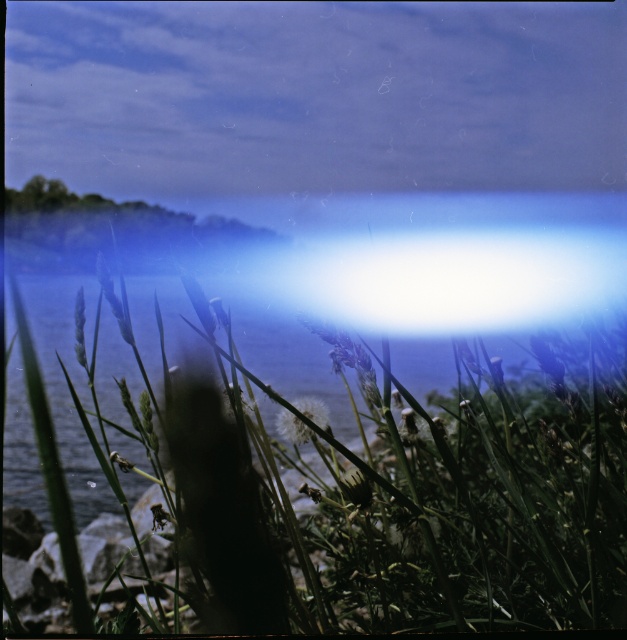
This screenshot has width=627, height=640. Describe the element at coordinates (356, 493) in the screenshot. I see `green grass at lower left` at that location.

Is point (436, 458) closer to camera compared to point (312, 413)?

No, it is behind (312, 413).

Is point (208, 608) closer to camera compared to point (292, 422)?

That is True.

Where is `green grass at lower left`? The image size is (627, 640). green grass at lower left is located at coordinates (356, 493).